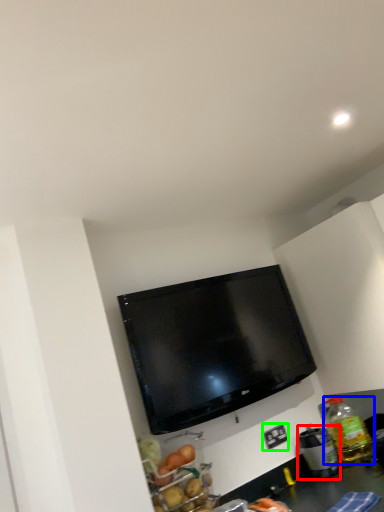
Question: Which object is positioned farthest from appliance (highlighted by a red box)? Select from bottle (highlighted by a blue box) and electric outlet (highlighted by a green box).

Choices:
 (A) bottle
 (B) electric outlet

Answer: (B)